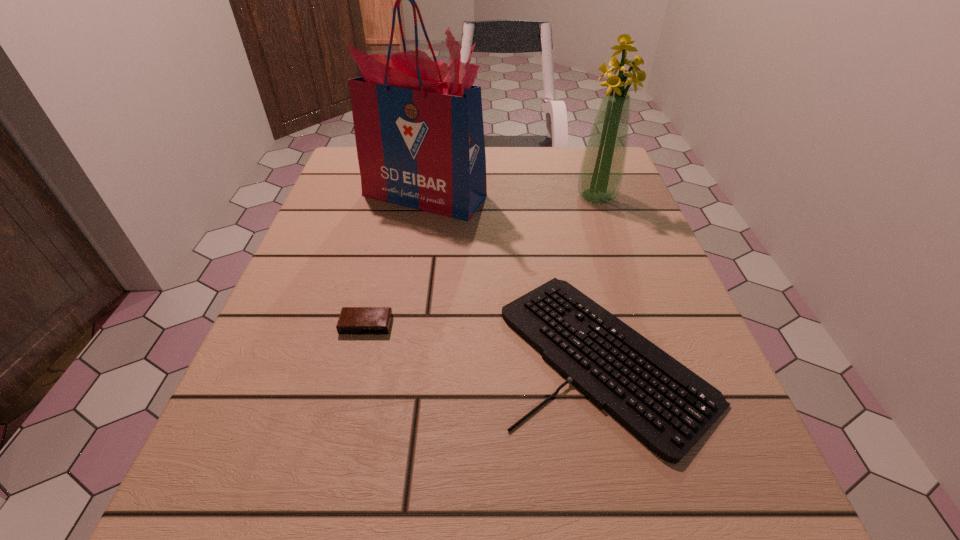
I want to click on free point between the bouquet and the computer keyboard, so click(x=601, y=275).

This screenshot has width=960, height=540. What are the coordinates of `object that is the third closest one to the grocery bag` in the screenshot? It's located at (353, 320).

Image resolution: width=960 pixels, height=540 pixels. What are the coordinates of `object that stands as the second closest to the computer keyboard` in the screenshot? It's located at (353, 320).

You are a GUI agent. You are given a task and a screenshot of the screen. Output one action in this format:
    pyautogui.click(x=<x>, y=<y>)
    Task: Click on the vacant point that satisfies the following two spatial constraints: 1. on the front-facing side of the computer keyboard; 2. on the right side of the tallest object
    
    Given the screenshot: What is the action you would take?
    pyautogui.click(x=397, y=355)

The height and width of the screenshot is (540, 960). I want to click on vacant space that satisfies the following two spatial constraints: 1. on the front-facing side of the tallest object; 2. on the right side of the computer keyboard, so (x=397, y=355).

At what (x,y) coordinates should I click in order to perform the action: click on vacant position in the image that satisfies the following two spatial constraints: 1. on the front-facing side of the grocery bag; 2. on the left side of the computer keyboard. Please return your answer as a coordinate pair (x, y). Looking at the image, I should click on (397, 355).

I want to click on vacant space that satisfies the following two spatial constraints: 1. on the front face of the alarm clock; 2. on the left side of the computer keyboard, so click(x=359, y=355).